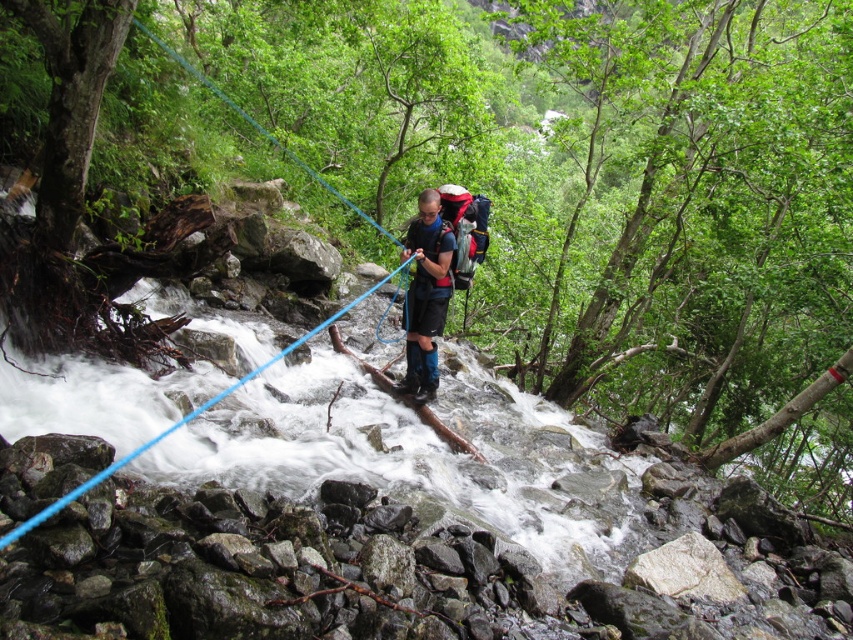
Question: Is matte black backpack at center smaller than blue synthetic rope at center?

Choices:
 (A) yes
 (B) no

Answer: (A)

Question: Which object appears closest to the camera in this image?

Choices:
 (A) matte black backpack at center
 (B) blue synthetic rope at center

Answer: (B)

Question: Which of the following is the farthest from the observer?

Choices:
 (A) (434, 273)
 (B) (247, 374)

Answer: (B)

Question: Does matte black backpack at center appear on the left side of blue synthetic rope at center?

Choices:
 (A) yes
 (B) no

Answer: (B)

Question: From the image, what is the correct spatial relationship of matte black backpack at center in relation to blue synthetic rope at center?

Choices:
 (A) below
 (B) above

Answer: (A)